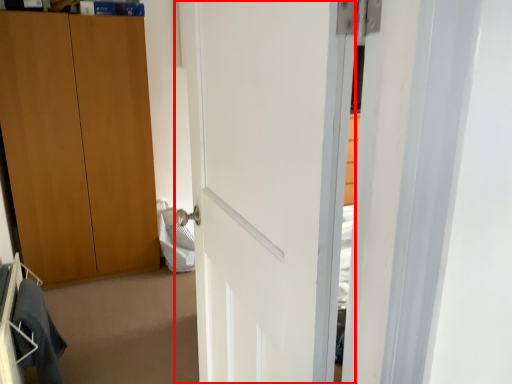
Question: From the image's perspective, considering the relative positions of door (annotated by the red box) and robe in the image provided, where is door (annotated by the red box) located with respect to the staircase?

Choices:
 (A) below
 (B) above

Answer: (B)